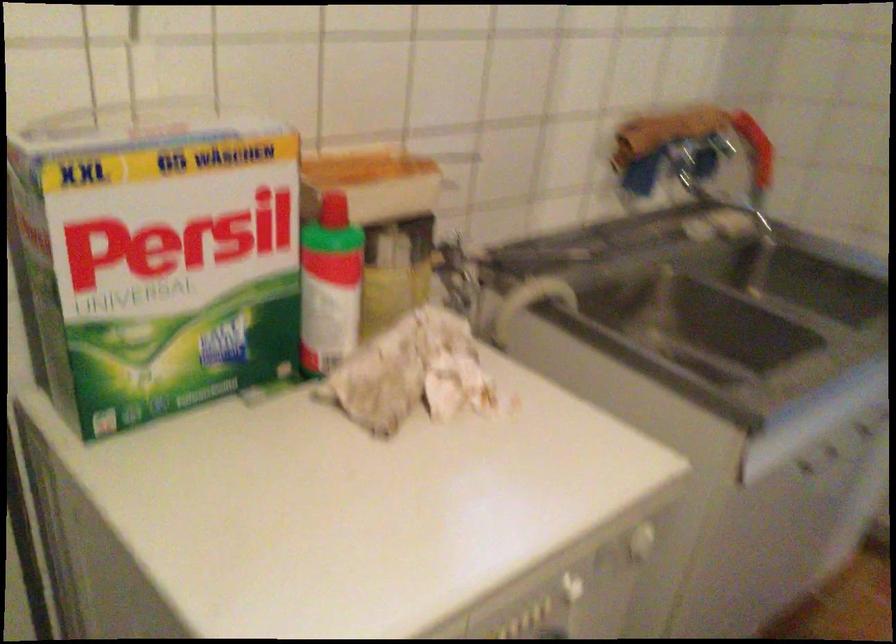
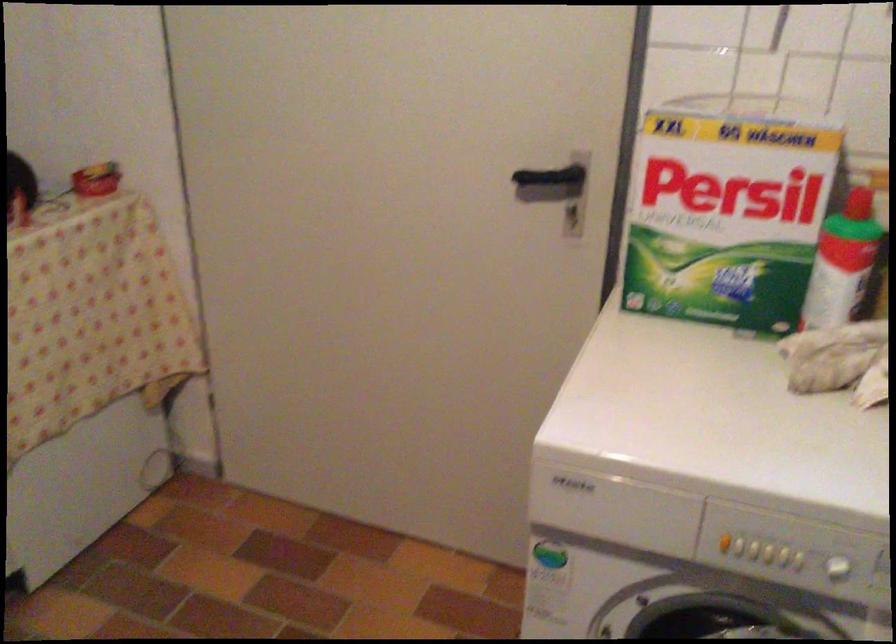
In the second image, find the point that corresponds to (x=348, y=283) in the first image.

(842, 263)